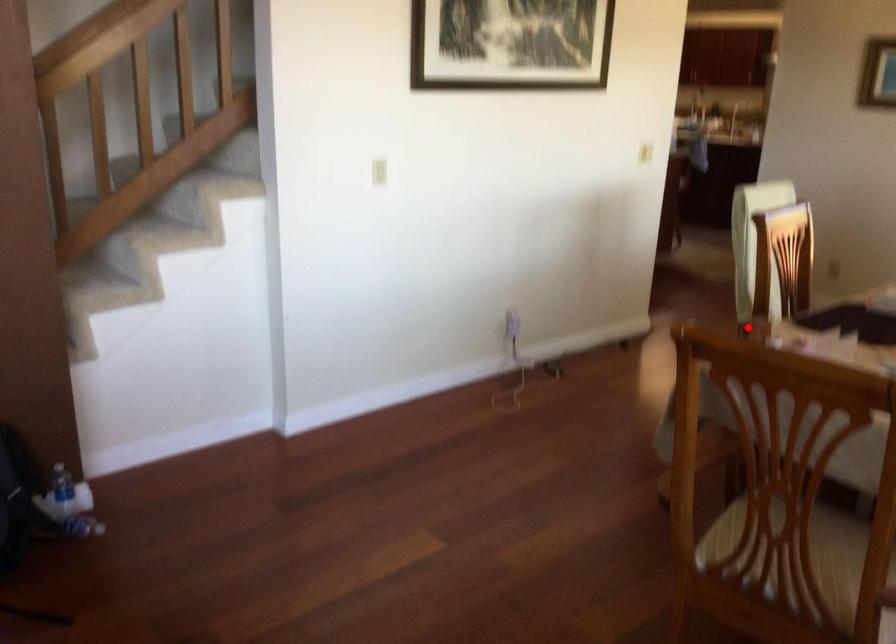
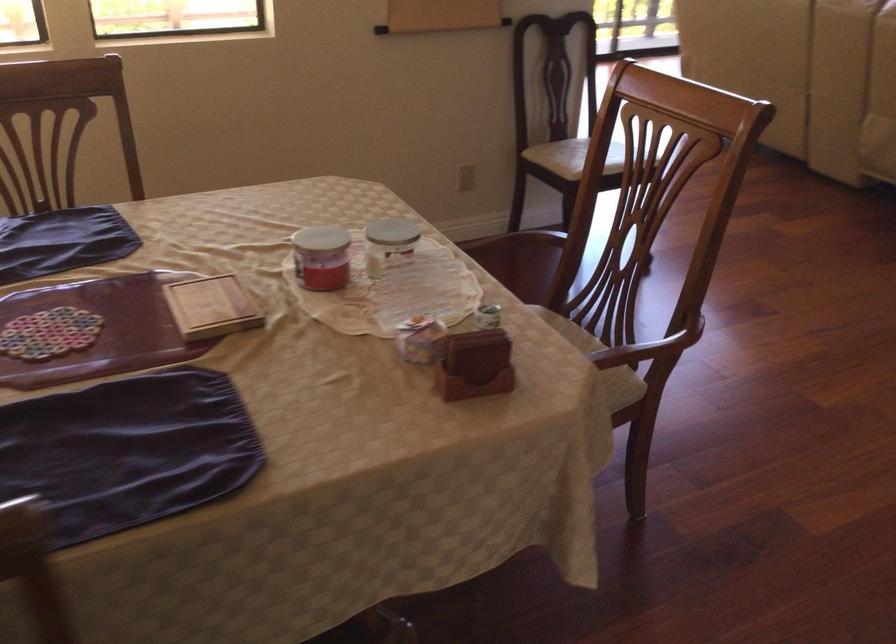
Question: I am providing you with two images of the same scene from different viewpoints. A red point is marked on the first image. At the location where the point appears in image 1, is it still visible in image 2?

Choices:
 (A) Yes
 (B) No

Answer: (A)